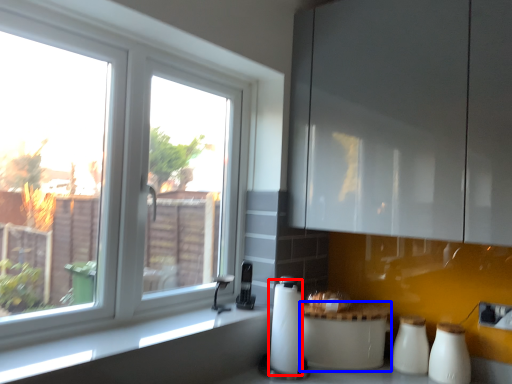
Question: Which of the following is the farthest to the observer, paper towel (highlighted by a red box) or appliance (highlighted by a blue box)?

Choices:
 (A) paper towel
 (B) appliance

Answer: (B)